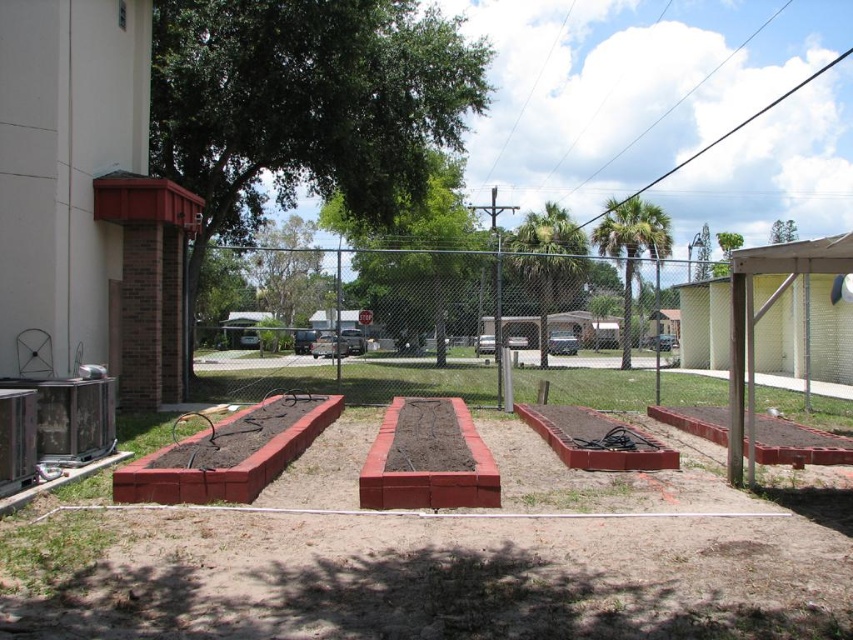
Question: Can you confirm if metallic chain-link fence at center is thinner than red brick flower bed at lower left?

Choices:
 (A) no
 (B) yes

Answer: (A)

Question: Is metallic chain-link fence at center positioned behind brown brick flower bed at center?

Choices:
 (A) yes
 (B) no

Answer: (B)

Question: Among these objects, which one is farthest from the camera?

Choices:
 (A) metallic chain-link fence at center
 (B) red brick flower bed at lower left

Answer: (B)

Question: Which is nearer to the brown brick flower bed at center?

Choices:
 (A) metallic chain-link fence at center
 (B) red brick flower bed at lower left

Answer: (B)

Question: From the image, what is the correct spatial relationship of metallic chain-link fence at center in relation to brown brick flower bed at center?

Choices:
 (A) left
 (B) right

Answer: (B)

Question: Which point is farther to the camera?

Choices:
 (A) brown brick flower bed at center
 (B) red brick flower bed at lower left
 (C) metallic chain-link fence at center

Answer: (A)